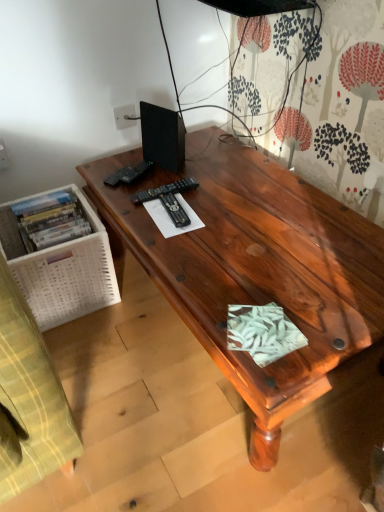
This screenshot has width=384, height=512. Find the location of `unoccupied space behind black matte speaker at upper left`. unoccupied space behind black matte speaker at upper left is located at coordinates (196, 141).